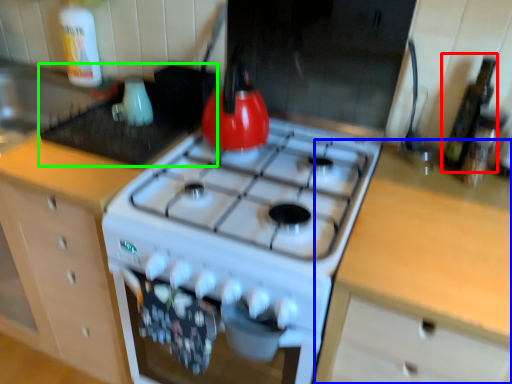
Question: Considering the real-world distances, which object is farthest from bottle (highlighted by a red box)? counter (highlighted by a blue box) or appliance (highlighted by a green box)?

Choices:
 (A) counter
 (B) appliance

Answer: (B)